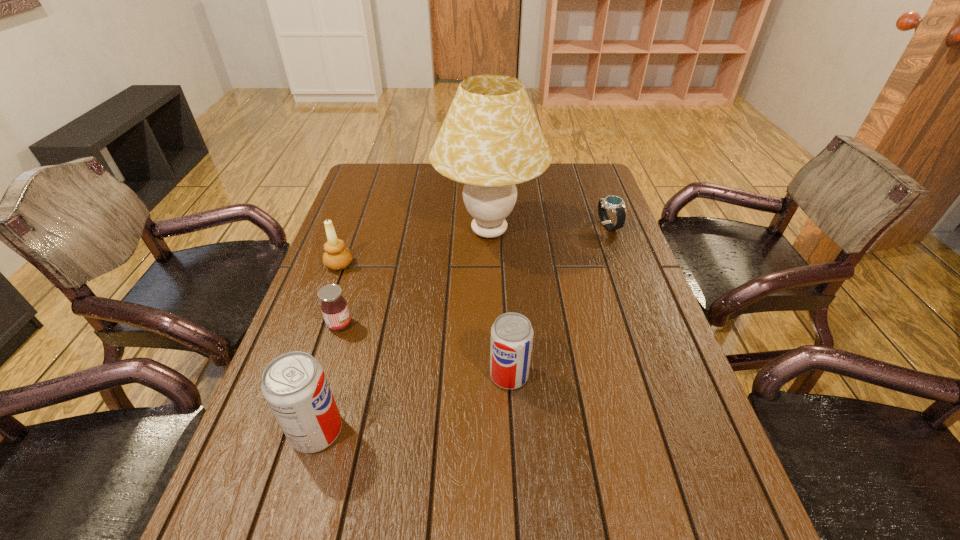
Locate an element on the screen. the taller soda is located at coordinates (294, 384).

Locate an element on the screen. The image size is (960, 540). the nearest object is located at coordinates (294, 384).

Find the location of a particular element. Image resolution: width=960 pixels, height=540 pixels. the farther soda is located at coordinates (512, 334).

You are a GUI agent. You are given a task and a screenshot of the screen. Output one action in this format:
    pyautogui.click(x=<x>, y=<y>)
    Task: Click on the right soda
    
    Given the screenshot: What is the action you would take?
    pyautogui.click(x=512, y=334)

Find the location of a particular element. The image size is (960, 540). the tallest object is located at coordinates (490, 140).

At what (x,y) coordinates should I click in order to perform the action: click on watch. Please return your answer as a coordinate pair (x, y). Looking at the image, I should click on (616, 204).

Find the location of a particular element. Image resolution: width=960 pixels, height=540 pixels. the shortest object is located at coordinates (616, 204).

Find the location of a particular element. This screenshot has width=960, height=540. candle_holder is located at coordinates (336, 256).

Locate an element on the screen. jam is located at coordinates (334, 307).

Where is `the fifth tallest object`? Image resolution: width=960 pixels, height=540 pixels. the fifth tallest object is located at coordinates (334, 307).